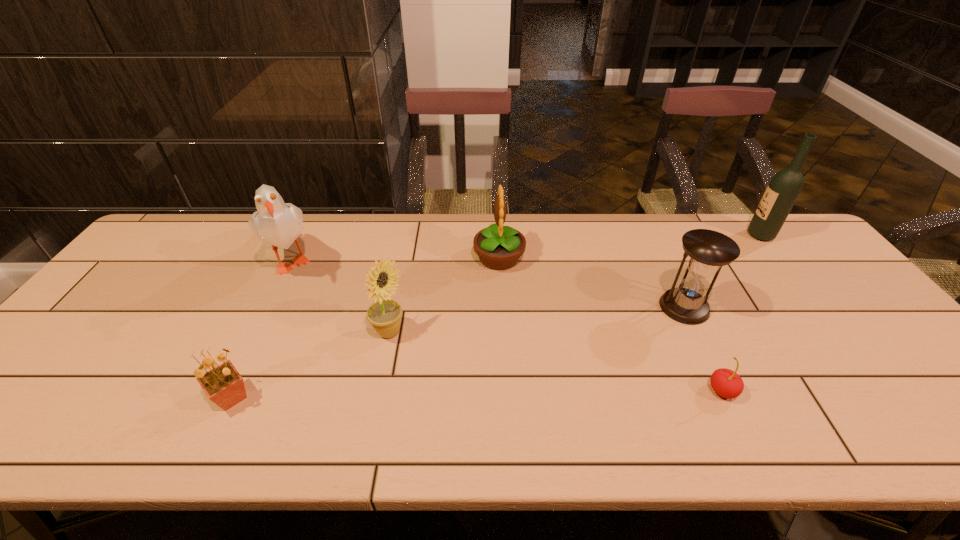
Where is `wine bottle`? This screenshot has height=540, width=960. wine bottle is located at coordinates (784, 188).

You are a GUI agent. You are given a task and a screenshot of the screen. Output one action in this format:
    pyautogui.click(x=<x>, y=<y>)
    Task: Click on the gull
    
    Given the screenshot: What is the action you would take?
    pyautogui.click(x=279, y=224)

Locate an element on the screen. The height and width of the screenshot is (540, 960). the farthest sunflower is located at coordinates (498, 247).

This screenshot has height=540, width=960. I want to click on the fourth object from right to left, so click(498, 247).

This screenshot has width=960, height=540. I want to click on the second nearest sunflower, so click(384, 315).

Where is `the second sunflower from left to right`? This screenshot has height=540, width=960. the second sunflower from left to right is located at coordinates (384, 315).

The width and height of the screenshot is (960, 540). What are the coordinates of `hourglass` in the screenshot? It's located at (707, 251).

This screenshot has height=540, width=960. Find the location of `the shortest sunflower`. the shortest sunflower is located at coordinates (223, 385).

Find the location of a particular element. the nearest sunflower is located at coordinates (223, 385).

Locate an element on the screen. The width and height of the screenshot is (960, 540). the shortest object is located at coordinates (726, 383).